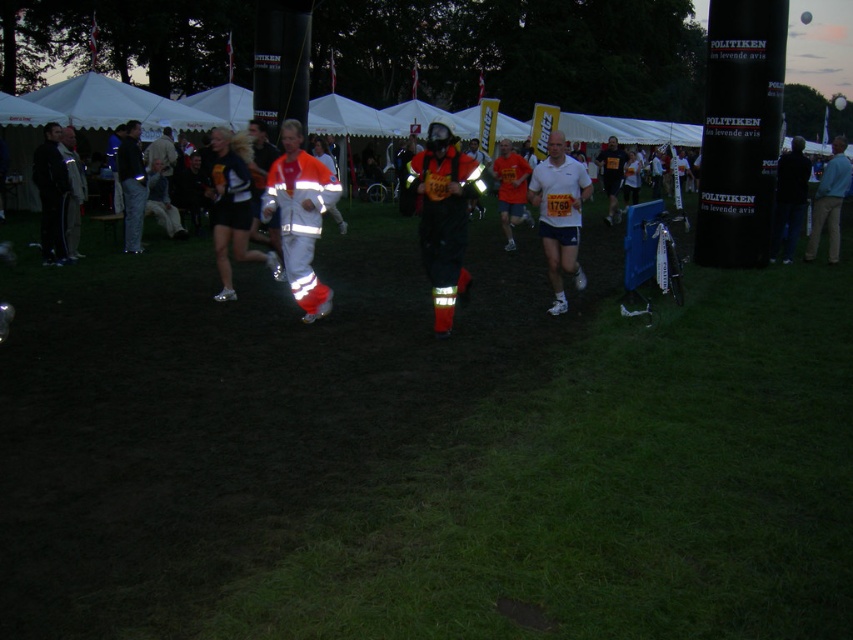
Is reflective white santa at center closer to the viewer compared to white matte shirt at center?

Yes, it is.

What do you see at coordinates (300, 216) in the screenshot?
I see `reflective white santa at center` at bounding box center [300, 216].

This screenshot has width=853, height=640. In order to click on reflective white santa at center in this screenshot , I will do `click(300, 216)`.